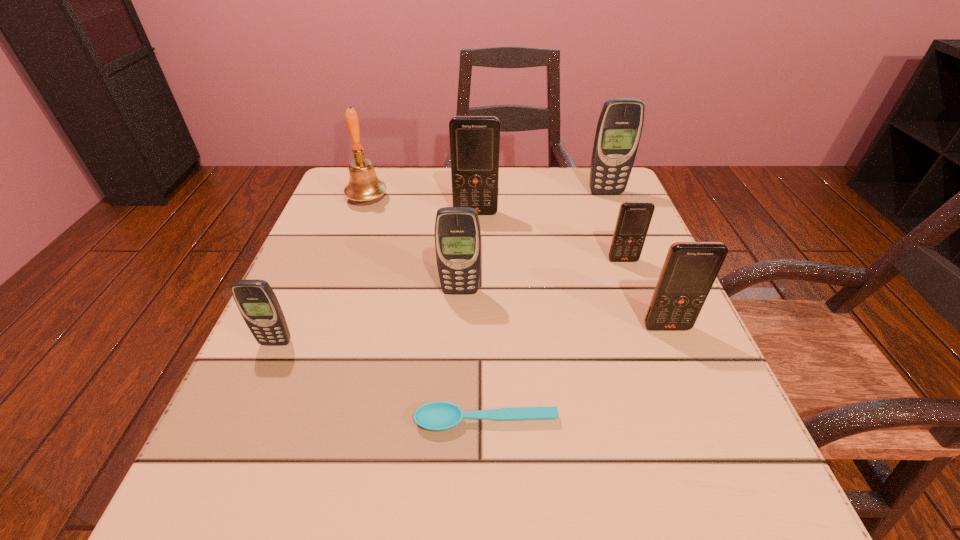
Find the location of a particular element. free space located on the screen of the fourth farthest object is located at coordinates (654, 341).

Image resolution: width=960 pixels, height=540 pixels. Identify the location of blank space located 0.070m on the screen of the leftmost gray cellular telephone. (258, 382).

Locate an element on the screen. vacant space located 0.250m on the left of the blue spoon is located at coordinates (236, 422).

The width and height of the screenshot is (960, 540). I want to click on bell located in the far edge section of the desktop, so click(364, 185).

Locate an element on the screen. The height and width of the screenshot is (540, 960). bell at the left edge is located at coordinates (364, 185).

Find the location of a particular element. This screenshot has width=960, height=540. cellular telephone at the left edge is located at coordinates (255, 299).

The width and height of the screenshot is (960, 540). What are the coordinates of `object that is at the far left corner` in the screenshot? It's located at (364, 185).

The image size is (960, 540). What are the coordinates of `object that is at the far right corner` in the screenshot? It's located at (619, 128).

The image size is (960, 540). Find the location of `vacant region at the far edge`. vacant region at the far edge is located at coordinates (436, 171).

In the image, there is a desktop. Where is `vacant space at the near edge`? The image size is (960, 540). vacant space at the near edge is located at coordinates (541, 477).